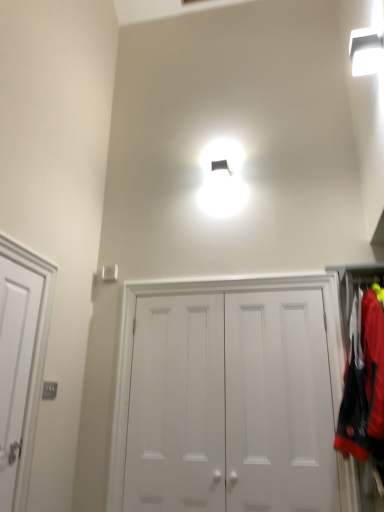
Question: Considering the relative sizes of red fabric laundry at right and white matte door at center, which ranks as the 3th door in left-to-right order, in the image provided, is red fabric laundry at right bigger than white matte door at center, which ranks as the 3th door in left-to-right order,?

Choices:
 (A) no
 (B) yes

Answer: (B)

Question: Does red fabric laundry at right appear on the right side of white matte door at center, placed as the first door when sorted from right to left?

Choices:
 (A) no
 (B) yes

Answer: (B)

Question: Considering the relative sizes of red fabric laundry at right and white matte door at center, which ranks as the 3th door in left-to-right order, in the image provided, is red fabric laundry at right smaller than white matte door at center, which ranks as the 3th door in left-to-right order,?

Choices:
 (A) yes
 (B) no

Answer: (B)

Question: Can you confirm if red fabric laundry at right is taller than white matte door at center, which ranks as the 3th door in left-to-right order?

Choices:
 (A) yes
 (B) no

Answer: (B)

Question: Considering the relative sizes of red fabric laundry at right and white matte door at center, placed as the first door when sorted from right to left, in the image provided, is red fabric laundry at right thinner than white matte door at center, placed as the first door when sorted from right to left,?

Choices:
 (A) yes
 (B) no

Answer: (B)

Question: Considering the relative positions of red fabric laundry at right and white matte door at left, which is the first door from left to right, in the image provided, is red fabric laundry at right to the left or to the right of white matte door at left, which is the first door from left to right,?

Choices:
 (A) right
 (B) left

Answer: (A)

Question: In terms of width, does red fabric laundry at right look wider or thinner when compared to white matte door at left, which is the first door from left to right?

Choices:
 (A) wide
 (B) thin

Answer: (A)

Question: Is red fabric laundry at right in front of or behind white matte door at left, which is the first door from left to right, in the image?

Choices:
 (A) front
 (B) behind

Answer: (B)

Question: Considering the positions of red fabric laundry at right and white matte door at left, which is the first door from left to right, in the image, is red fabric laundry at right taller or shorter than white matte door at left, which is the first door from left to right,?

Choices:
 (A) tall
 (B) short

Answer: (B)

Question: From their relative heights in the image, would you say white matte door at center, which ranks as the 3th door in left-to-right order, is taller or shorter than red fabric laundry at right?

Choices:
 (A) short
 (B) tall

Answer: (B)

Question: In terms of size, does white matte door at center, which ranks as the 3th door in left-to-right order, appear bigger or smaller than red fabric laundry at right?

Choices:
 (A) small
 (B) big

Answer: (A)

Question: From the image's perspective, is white matte door at center, placed as the first door when sorted from right to left, above or below red fabric laundry at right?

Choices:
 (A) below
 (B) above

Answer: (A)

Question: Is white matte door at center, placed as the first door when sorted from right to left, in front of or behind red fabric laundry at right in the image?

Choices:
 (A) behind
 (B) front

Answer: (A)

Question: Would you say red fabric laundry at right is to the left or to the right of white matte door at center, which ranks as the 3th door in left-to-right order, in the picture?

Choices:
 (A) right
 (B) left

Answer: (A)

Question: From a real-world perspective, is red fabric laundry at right above or below white matte door at center, placed as the first door when sorted from right to left?

Choices:
 (A) above
 (B) below

Answer: (A)